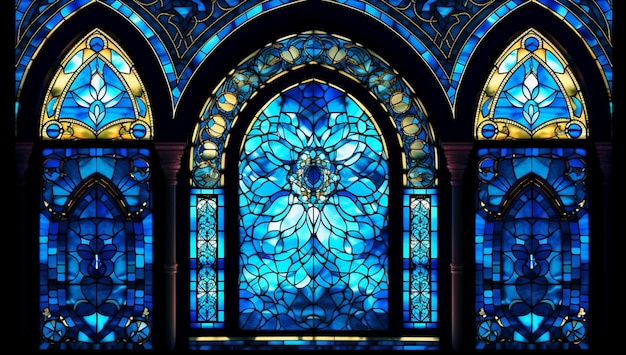
Where is `left blue vertical rectangular window`? left blue vertical rectangular window is located at coordinates (196, 267).